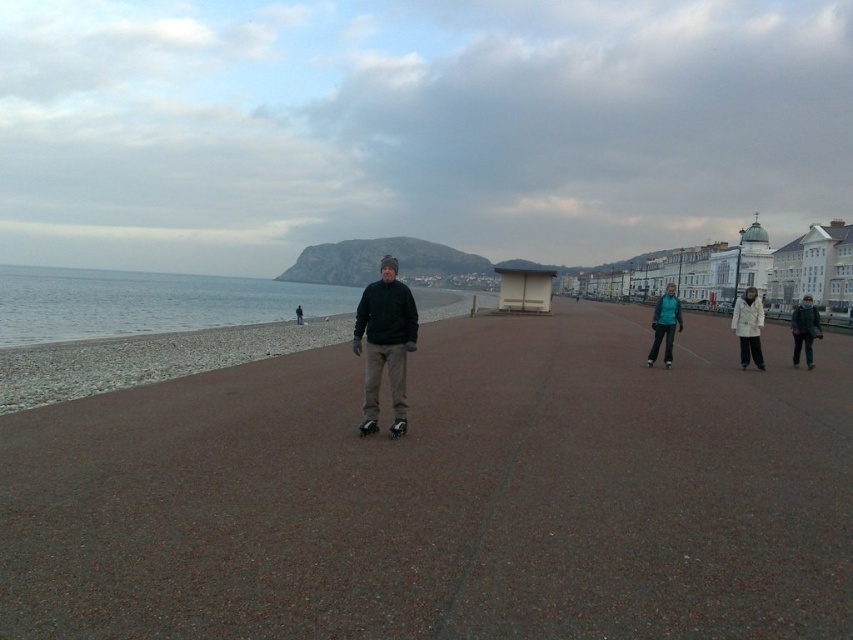
Can you confirm if brown textured pavement at center is thinner than teal fabric jacket at center-right?

Correct, brown textured pavement at center's width is less than teal fabric jacket at center-right's.

Identify the location of brown textured pavement at center. The height and width of the screenshot is (640, 853). (445, 496).

Where is `brown textured pavement at center`? This screenshot has height=640, width=853. brown textured pavement at center is located at coordinates (445, 496).

In the scene shown: Is brown textured pavement at center to the right of white matte jacket at right from the viewer's perspective?

In fact, brown textured pavement at center is to the left of white matte jacket at right.

Which is more to the right, brown textured pavement at center or white matte jacket at right?

From the viewer's perspective, white matte jacket at right appears more on the right side.

What are the coordinates of `brown textured pavement at center` in the screenshot? It's located at (445, 496).

Identify the location of brown textured pavement at center. (445, 496).

In the scene shown: Is white matte jacket at right bigger than dark blue jacket at right?

Yes.

Which is in front, point (755, 348) or point (805, 336)?

Point (755, 348)

Where is `white matte jacket at right`? white matte jacket at right is located at coordinates (747, 326).